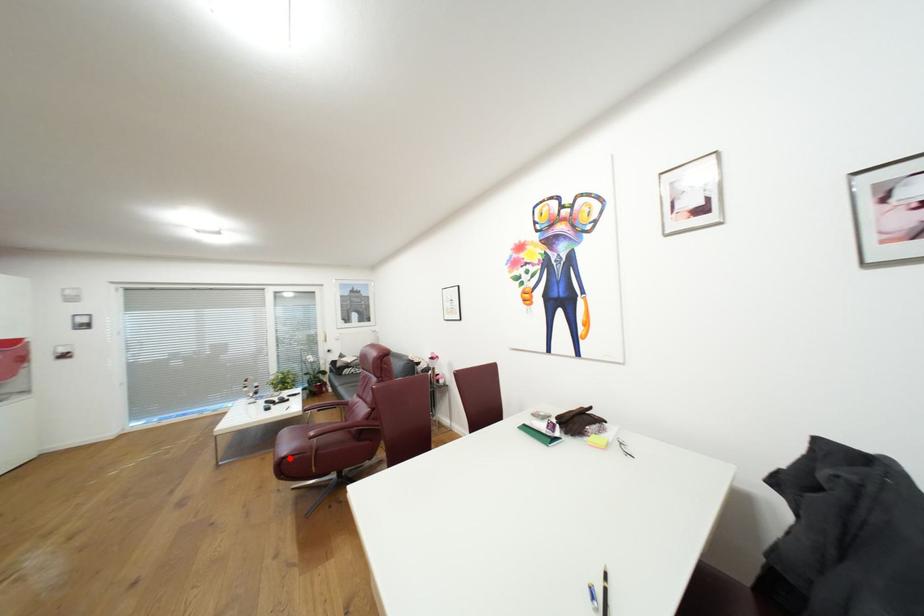
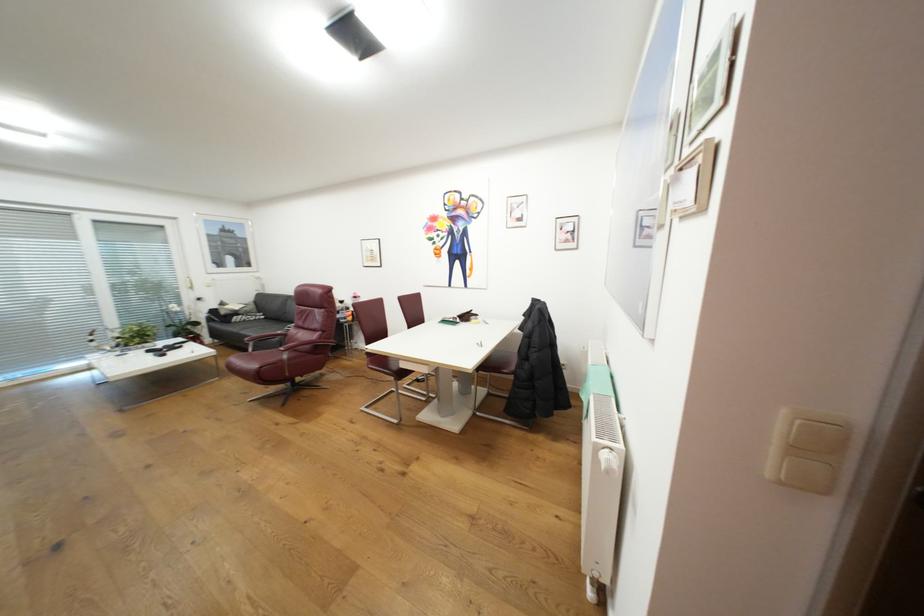
The point at the highlighted location is marked in the first image. Where is the corresponding point in the second image?

(268, 368)